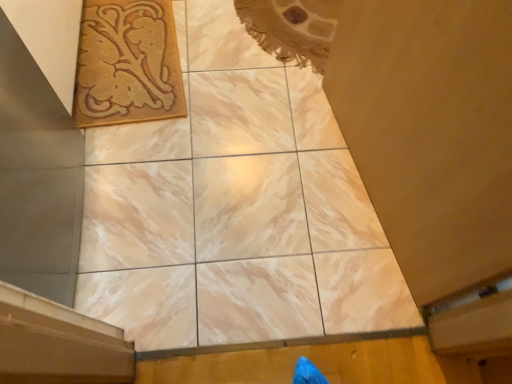
At what (x,y) coordinates should I click in order to perform the action: click on empty space that is to the right of marble tile at center. Please return your answer as a coordinate pair (x, y). This screenshot has height=384, width=512. Looking at the image, I should click on (296, 212).